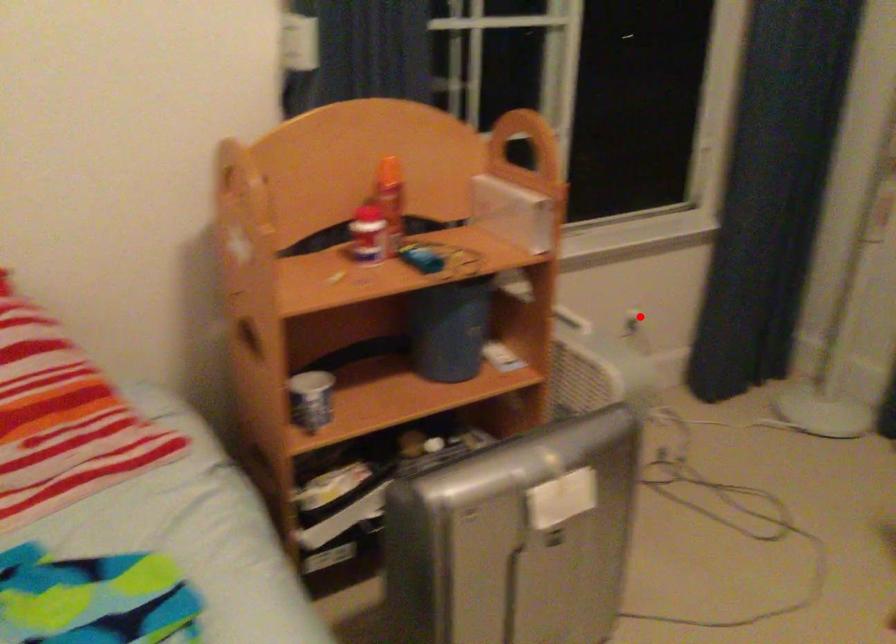
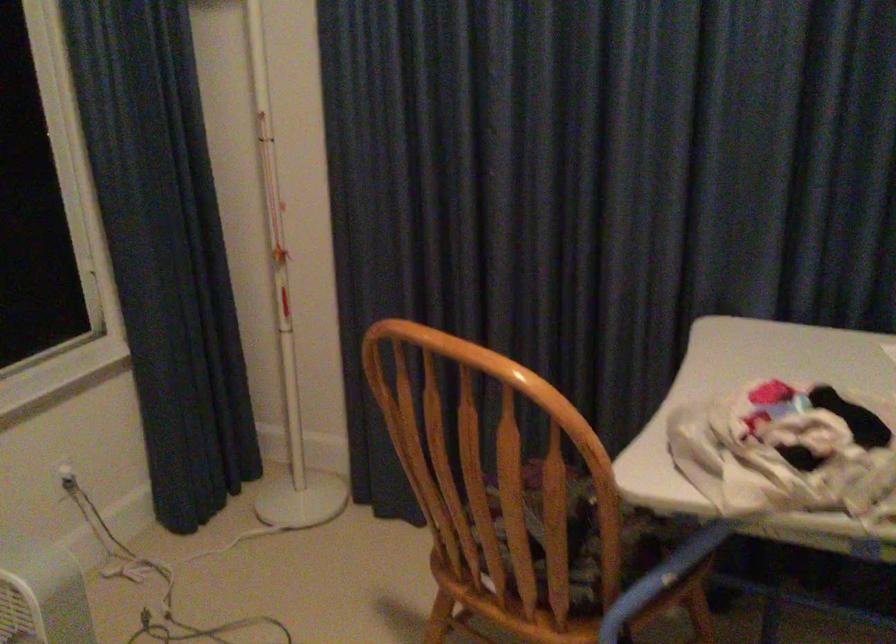
Locate, in the second image, the point that corresponds to the highlighted location in the first image.

(65, 478)